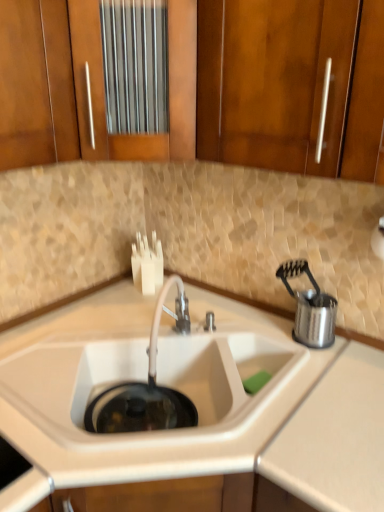
Identify the location of vacant space situated above white matte sink at center (from a real-world perspective). This screenshot has width=384, height=512. (134, 335).